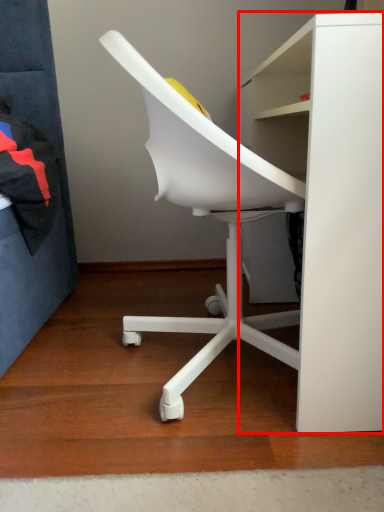
Question: From the image, what is the correct spatial relationship of desk (annotated by the red box) in relation to chair?

Choices:
 (A) left
 (B) right

Answer: (B)